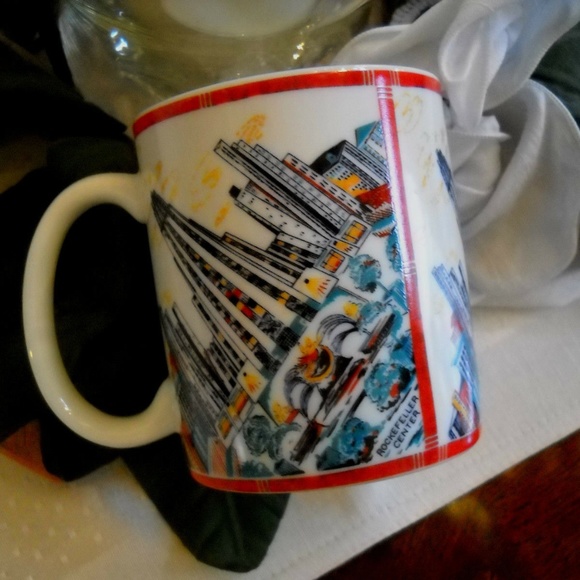
Where is `the bottom edge of cup`? The height and width of the screenshot is (580, 580). the bottom edge of cup is located at coordinates (375, 481).